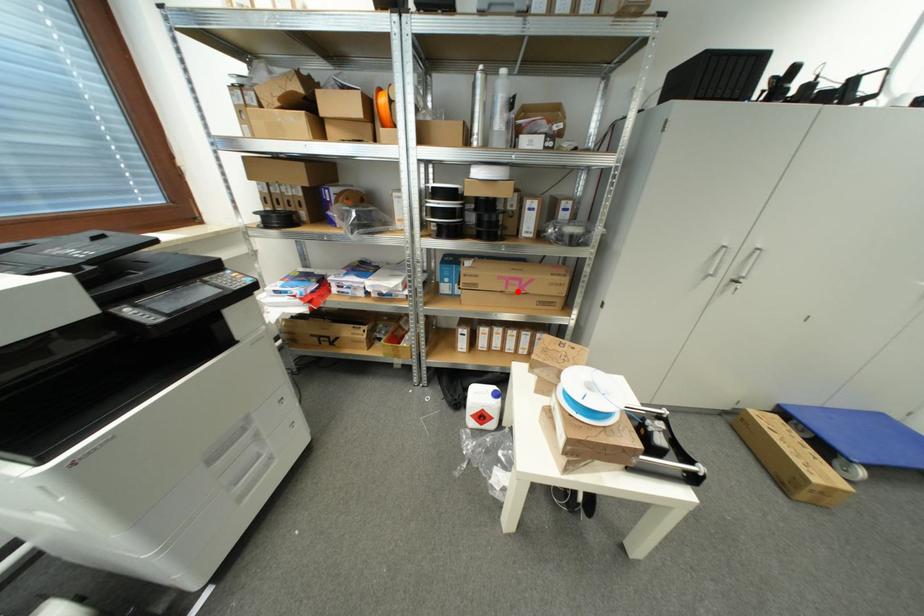
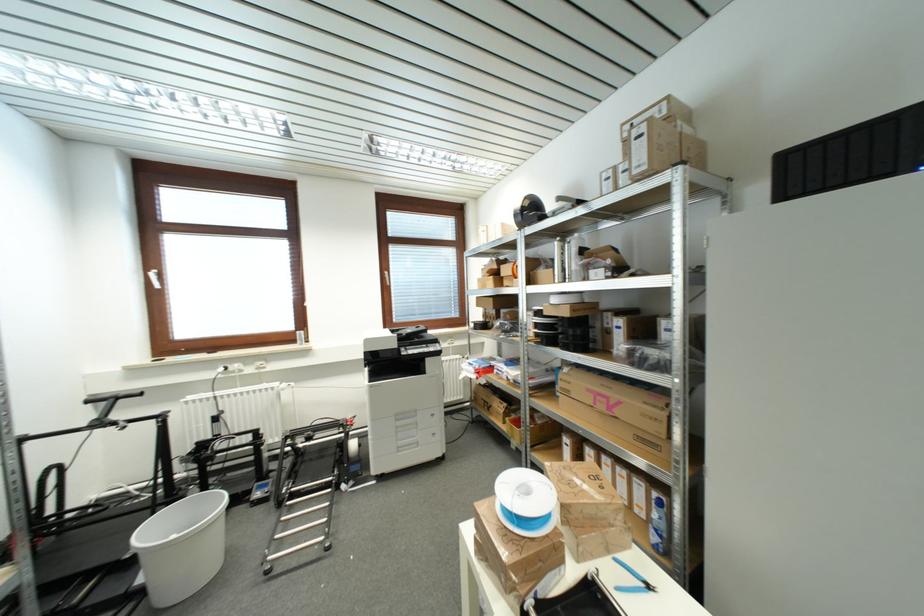
The point at the highlighted location is marked in the first image. Where is the corresponding point in the second image?

(605, 408)